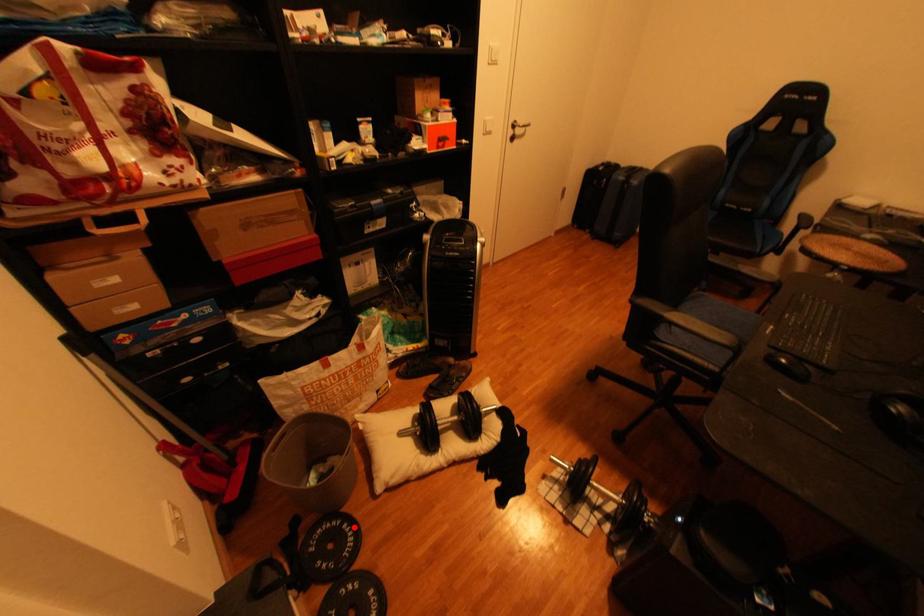
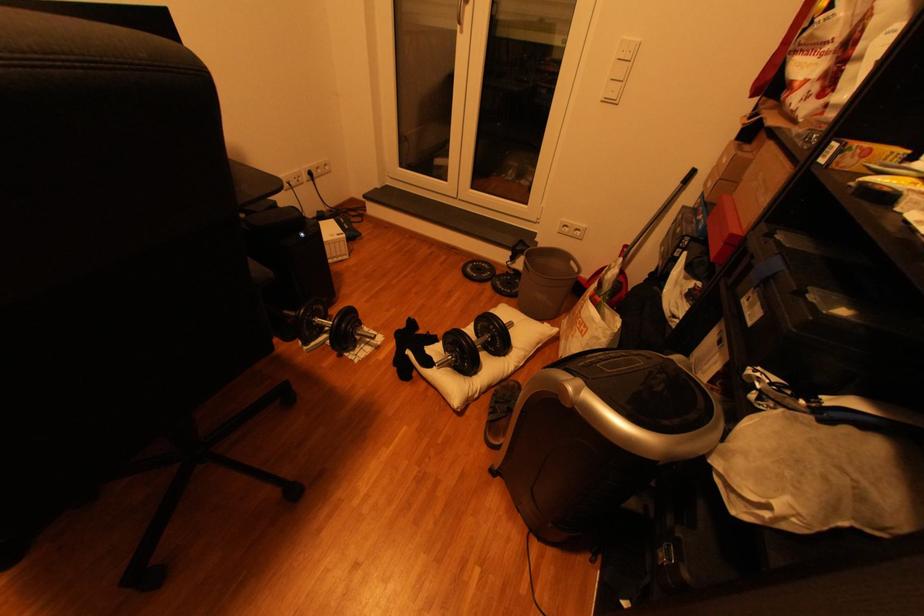
Where in the second image is the point corresponding to the highlighted location from the first image?

(518, 292)